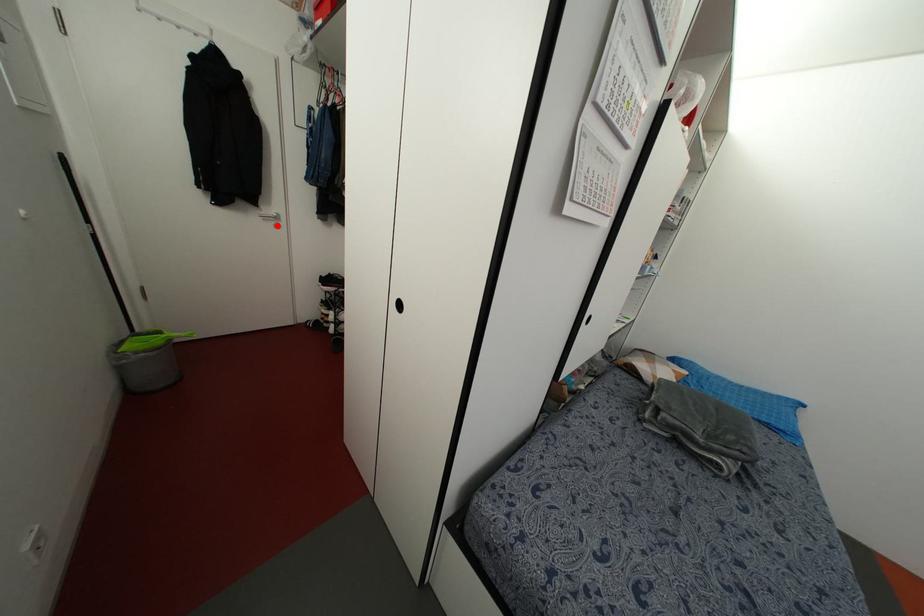
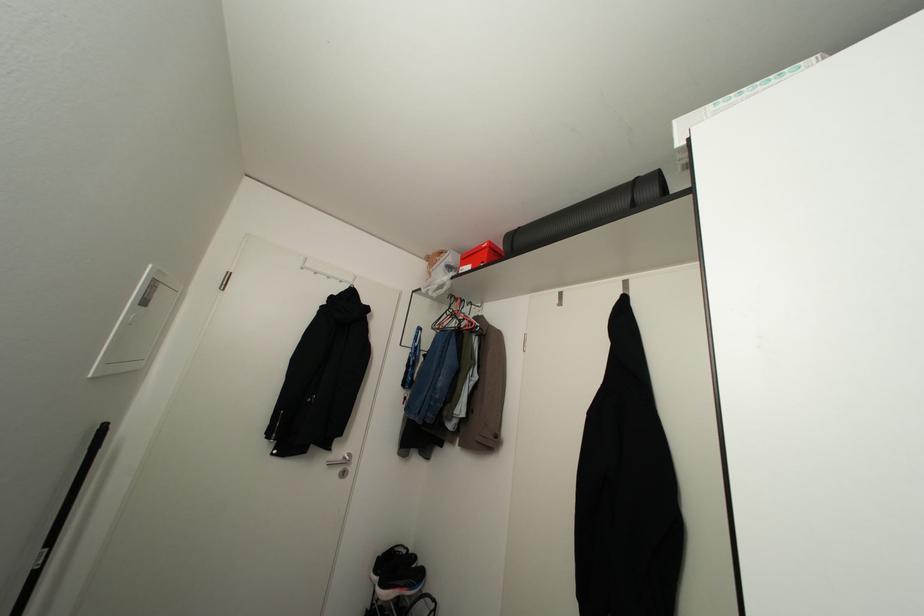
Question: I am providing you with two images of the same scene from different viewpoints. A red point is shown in image1. For the corresponding object point in image2, is it positioned nearer or farther from the camera?

Choices:
 (A) Nearer
 (B) Farther

Answer: (B)